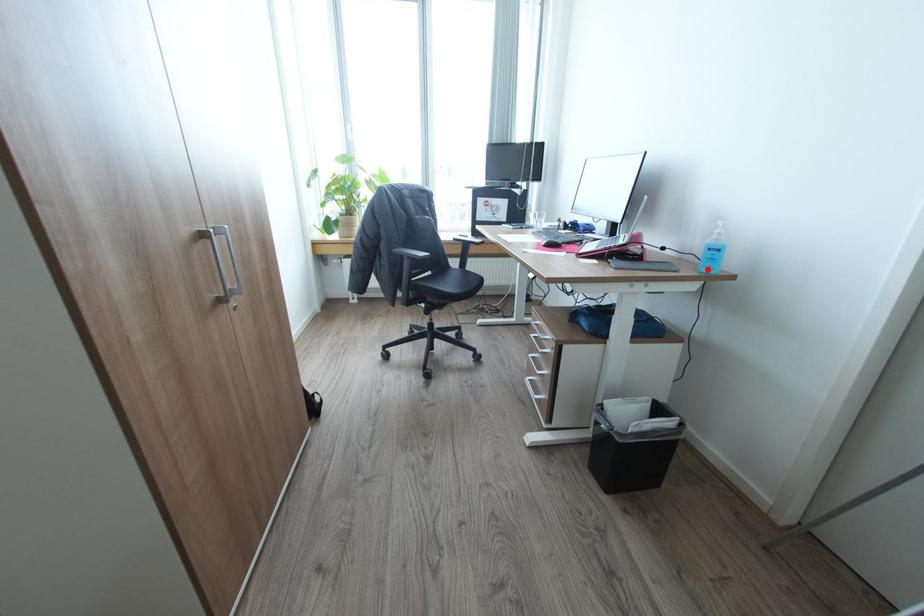
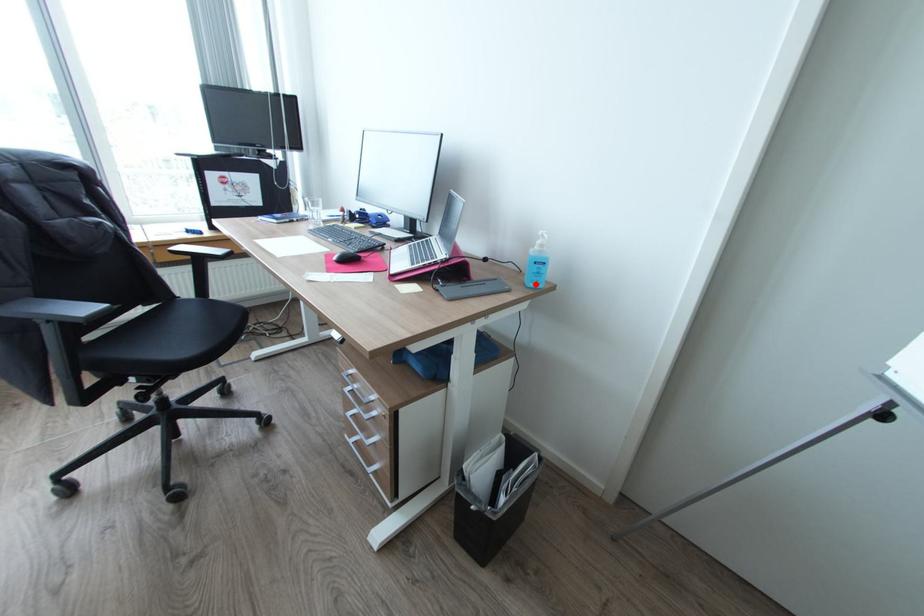
I am providing you with two images of the same scene from different viewpoints. A red point is marked on the first image and another point is marked on the second image. Is the red point in image1 aligned with the point shown in image2?

Yes